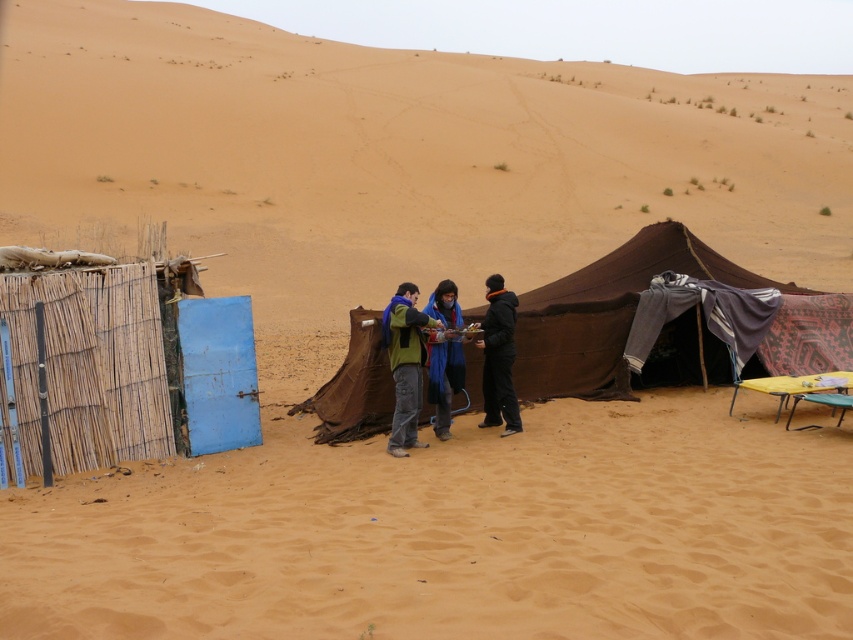
Question: Which of the following is the farthest from the observer?

Choices:
 (A) (517, 410)
 (B) (405, 307)

Answer: (A)

Question: Is fine-grained sand at center bigger than blue fabric scarf at center?

Choices:
 (A) yes
 (B) no

Answer: (B)

Question: Is brown fabric tent at center positioned at the back of green matte jacket at center?

Choices:
 (A) yes
 (B) no

Answer: (A)

Question: Where is black matte jacket at center located in relation to blue fabric scarf at center in the image?

Choices:
 (A) above
 (B) below

Answer: (B)

Question: Which object is positioned farthest from the woven bamboo fence at left?

Choices:
 (A) blue fabric scarf at center
 (B) brown fabric tent at center
 (C) green matte jacket at center
 (D) fine-grained sand at center

Answer: (D)

Question: Which of the following is the closest to the observer?

Choices:
 (A) (498, 337)
 (B) (59, 330)

Answer: (B)